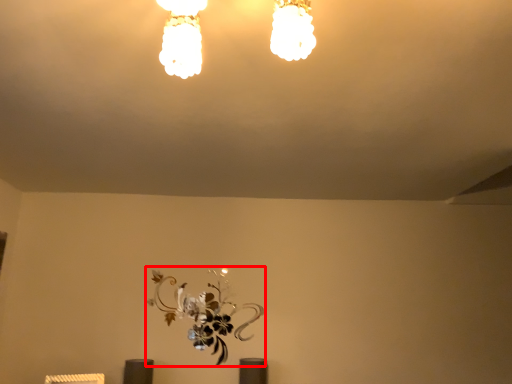
Question: From the image, what is the correct spatial relationship of flower (annotated by the red box) in relation to lamp?

Choices:
 (A) right
 (B) left

Answer: (B)